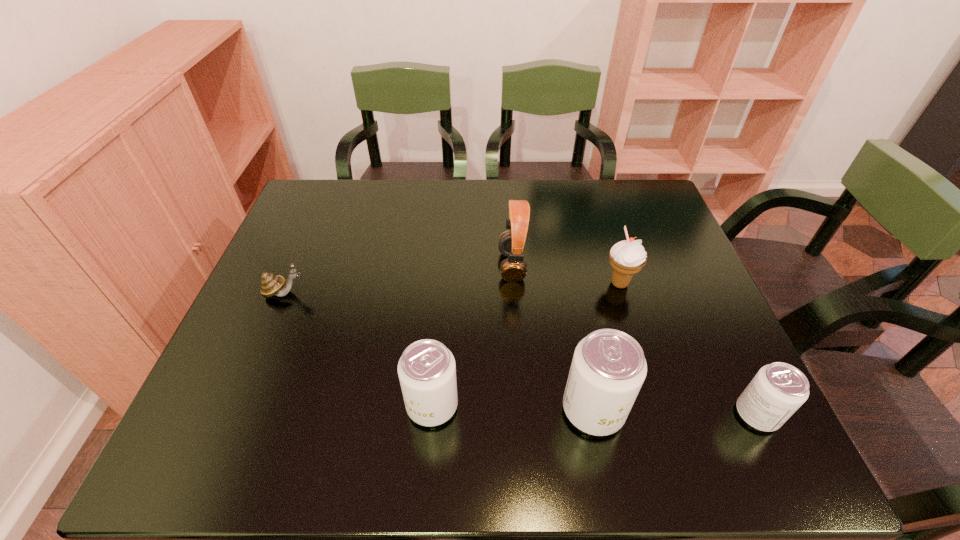
At what (x,y) coordinates should I click in order to perform the action: click on the second shortest soda can. Please return your answer as a coordinate pair (x, y). This screenshot has height=540, width=960. Looking at the image, I should click on (427, 372).

What are the coordinates of `the leftmost soda can` in the screenshot? It's located at (427, 372).

This screenshot has height=540, width=960. Find the location of `the fourth object from left to right`. the fourth object from left to right is located at coordinates (608, 368).

Where is `the tallest soda can`? The height and width of the screenshot is (540, 960). the tallest soda can is located at coordinates (608, 368).

Find the location of a particular element. The image size is (960, 540). the shortest soda can is located at coordinates (777, 391).

What are the coordinates of `the rightmost soda can` in the screenshot? It's located at (777, 391).

Where is `headset`? The image size is (960, 540). headset is located at coordinates (512, 243).

The height and width of the screenshot is (540, 960). Find the location of `the leftmost object`. the leftmost object is located at coordinates (271, 285).

Image resolution: width=960 pixels, height=540 pixels. Identify the location of the fifth object from left to right. (627, 257).

The image size is (960, 540). I want to click on blank space located on the left of the second tallest soda can, so click(x=377, y=405).